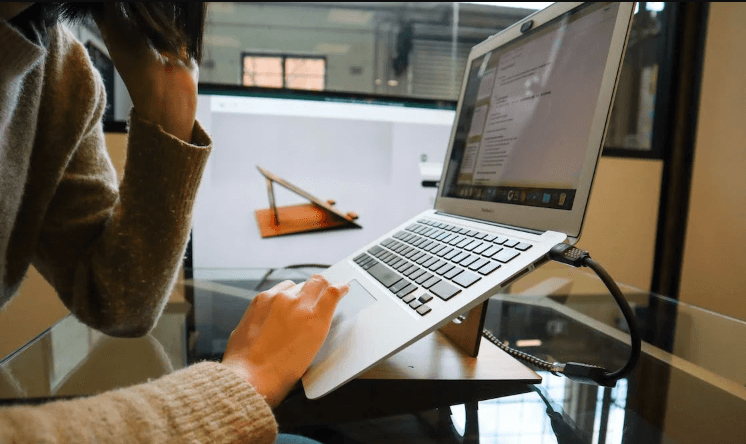
Identify the location of laptop. The image size is (746, 444). (530, 115).